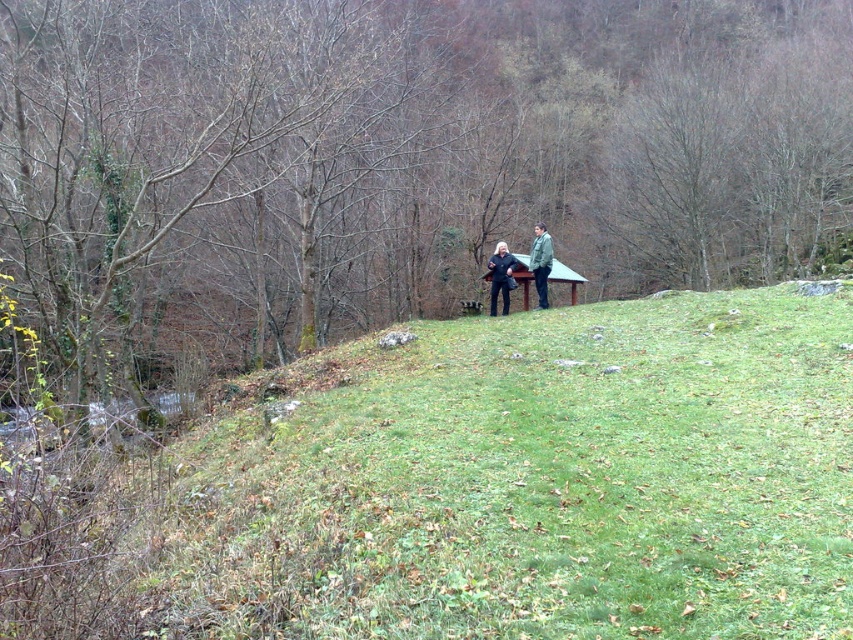
You are standing at the center of the image and want to locate the brown bark tree at center. Which direction should you look to find it?

The brown bark tree at center is located at point coordinates of (399, 157), so you should look slightly to the left and downward from the very center of the image to find it.